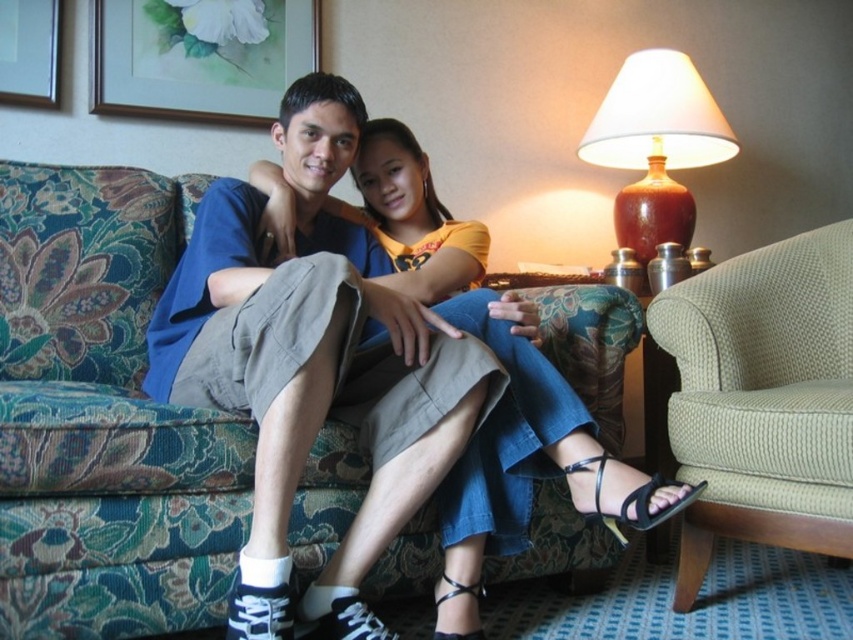
Is point (769, 253) more distant than point (91, 4)?

No.

Between point (730, 532) and point (262, 77), which one is positioned behind?

The point (262, 77) is behind.

Which is in front, point (741, 524) or point (123, 42)?

Point (741, 524)

Locate an element on the screen. The width and height of the screenshot is (853, 640). green fabric armchair at right is located at coordinates (763, 397).

Measure the distance from brown ceramic lamp at upper right to wooden picture frame at upper left.

The distance of brown ceramic lamp at upper right from wooden picture frame at upper left is 5.65 feet.

Between brown ceramic lamp at upper right and wooden picture frame at upper left, which one has less height?

wooden picture frame at upper left

Which is in front, point (689, 204) or point (4, 65)?

Point (4, 65) is more forward.

Where is `brown ceramic lamp at upper right`? brown ceramic lamp at upper right is located at coordinates (656, 145).

Between green fabric armchair at right and brown ceramic lamp at upper right, which one has more height?

green fabric armchair at right

Is green fabric armchair at right to the right of brown ceramic lamp at upper right from the viewer's perspective?

In fact, green fabric armchair at right is to the left of brown ceramic lamp at upper right.

What are the coordinates of `green fabric armchair at right` in the screenshot? It's located at (763, 397).

This screenshot has width=853, height=640. In order to click on green fabric armchair at right in this screenshot , I will do `click(763, 397)`.